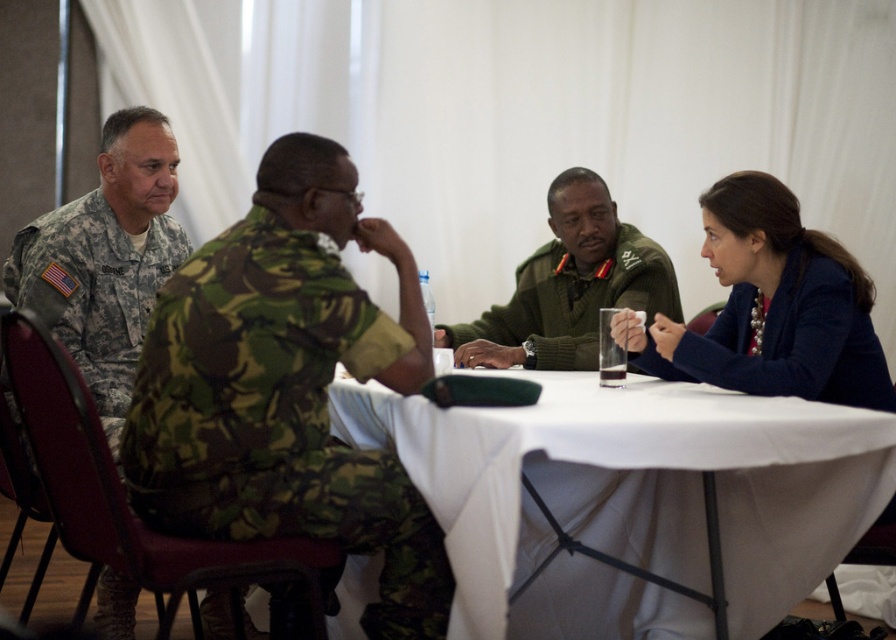
You are organizing a group photo and need to arrange the camouflage uniform at left and the green wool sweater at center based on their sizes. Which one should be placed in the front row to ensure visibility?

The camouflage uniform at left should be placed in the front row because it has a smaller size compared to the green wool sweater at center, ensuring visibility.

You are standing at the origin of the coordinate system in the image. The camouflage fabric uniform at center is located at point [277,413]. If you want to move towards the camouflage fabric uniform at center, in which direction should you move?

The point [277,413] is to the right and above the origin, so you should move towards the right and upwards to reach the camouflage fabric uniform at center.

You are sitting at a rectangular table in a conference room. You see a camouflage uniform at left and a green wool sweater at center. Which one is located more to the left side?

The camouflage uniform at left is more on the left side than the green wool sweater at center.